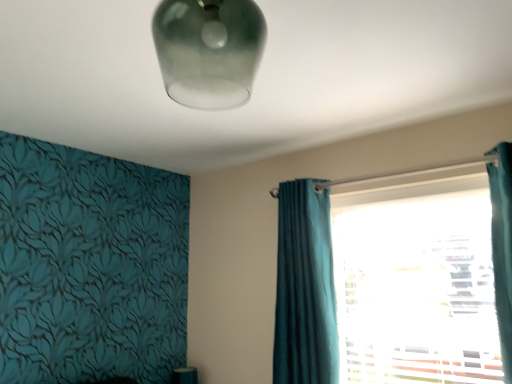
Question: Should I look upward or downward to see frosted glass lampshade at upper center?

Choices:
 (A) up
 (B) down

Answer: (A)

Question: Is frosted glass lampshade at upper center outside teal fabric curtain at right?

Choices:
 (A) yes
 (B) no

Answer: (A)

Question: From the image's perspective, is frosted glass lampshade at upper center beneath teal fabric curtain at right?

Choices:
 (A) yes
 (B) no

Answer: (B)

Question: Is the depth of frosted glass lampshade at upper center less than that of teal fabric curtain at right?

Choices:
 (A) yes
 (B) no

Answer: (A)

Question: Does frosted glass lampshade at upper center have a smaller size compared to teal fabric curtain at right?

Choices:
 (A) yes
 (B) no

Answer: (A)

Question: From a real-world perspective, is frosted glass lampshade at upper center located higher than teal fabric curtain at right?

Choices:
 (A) yes
 (B) no

Answer: (A)

Question: Is teal fabric curtain at right at the back of frosted glass lampshade at upper center?

Choices:
 (A) no
 (B) yes

Answer: (B)

Question: Considering the relative sizes of teal velvet curtain at center and teal fabric curtain at right in the image provided, is teal velvet curtain at center bigger than teal fabric curtain at right?

Choices:
 (A) yes
 (B) no

Answer: (B)

Question: Does teal velvet curtain at center appear on the right side of teal fabric curtain at right?

Choices:
 (A) yes
 (B) no

Answer: (B)

Question: Considering the relative sizes of teal velvet curtain at center and teal fabric curtain at right in the image provided, is teal velvet curtain at center smaller than teal fabric curtain at right?

Choices:
 (A) yes
 (B) no

Answer: (A)

Question: Is teal velvet curtain at center oriented towards teal fabric curtain at right?

Choices:
 (A) no
 (B) yes

Answer: (A)

Question: From a real-world perspective, is teal velvet curtain at center physically above teal fabric curtain at right?

Choices:
 (A) no
 (B) yes

Answer: (B)

Question: From the image's perspective, would you say teal velvet curtain at center is shown under teal fabric curtain at right?

Choices:
 (A) no
 (B) yes

Answer: (B)

Question: Considering the relative sizes of teal fabric curtain at right and frosted glass lampshade at upper center in the image provided, is teal fabric curtain at right shorter than frosted glass lampshade at upper center?

Choices:
 (A) no
 (B) yes

Answer: (A)